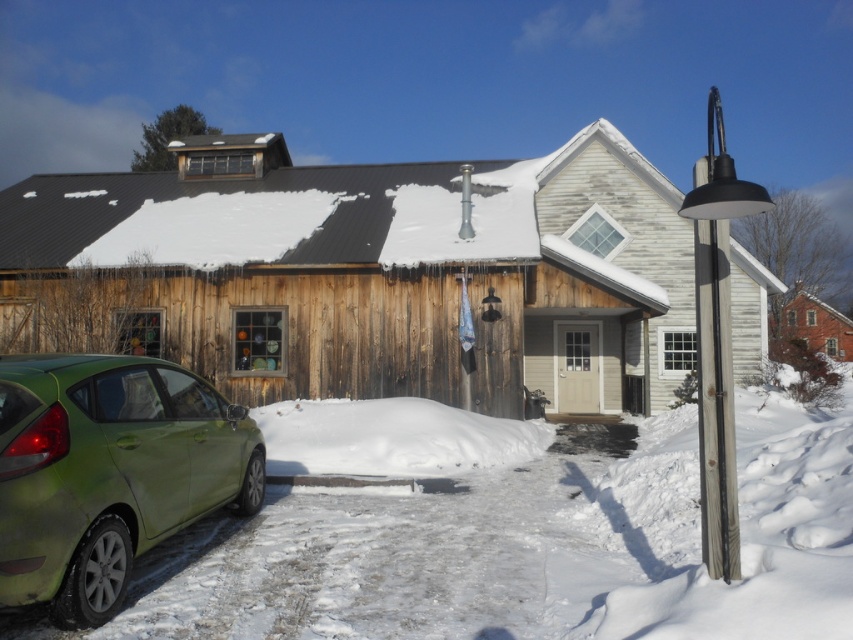
How distant is green matte car at lower left from white fluffy snow at lower center?

green matte car at lower left and white fluffy snow at lower center are 4.19 meters apart.

Can you confirm if green matte car at lower left is taller than white fluffy snow at lower center?

Indeed, green matte car at lower left has a greater height compared to white fluffy snow at lower center.

This screenshot has width=853, height=640. What do you see at coordinates (109, 472) in the screenshot? I see `green matte car at lower left` at bounding box center [109, 472].

The height and width of the screenshot is (640, 853). What are the coordinates of `green matte car at lower left` in the screenshot? It's located at (109, 472).